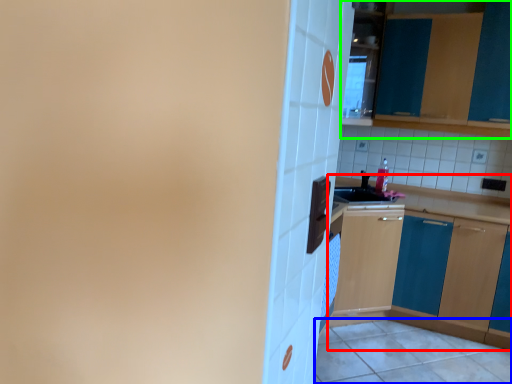
Question: Considering the real-world distances, which object is closest to cabinetry (highlighted by a red box)? tile (highlighted by a blue box) or cabinetry (highlighted by a green box).

Choices:
 (A) tile
 (B) cabinetry

Answer: (A)